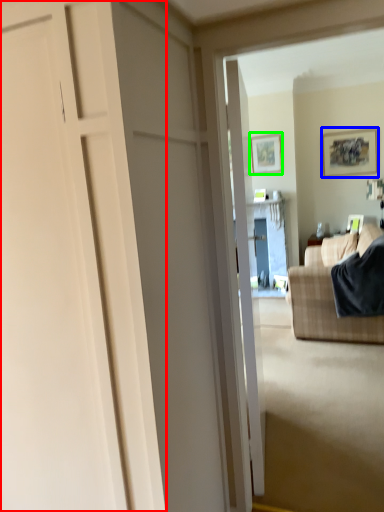
Question: Estimate the real-world distances between objects in this image. Which object is farther from door (highlighted by a red box), picture frame (highlighted by a blue box) or picture frame (highlighted by a green box)?

Choices:
 (A) picture frame
 (B) picture frame

Answer: (B)